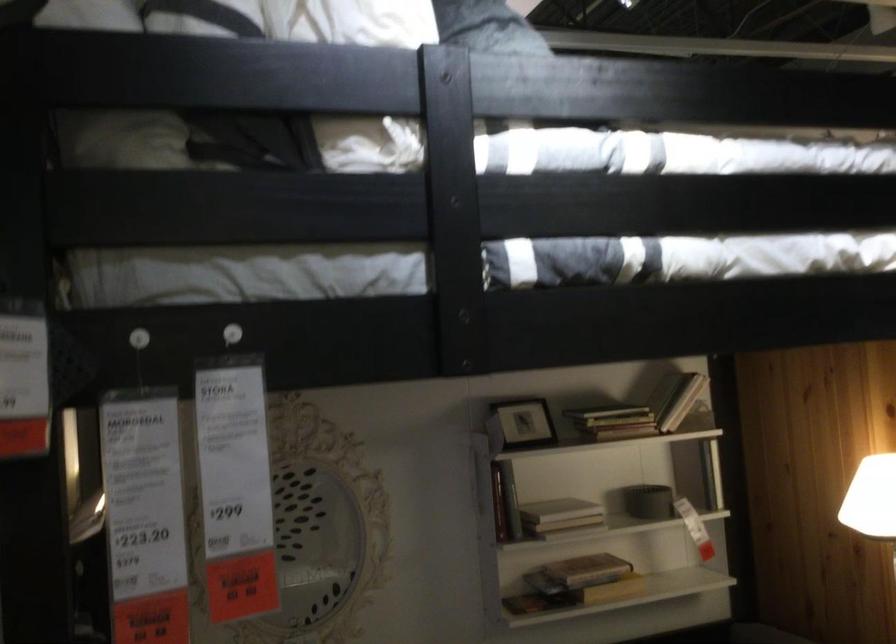
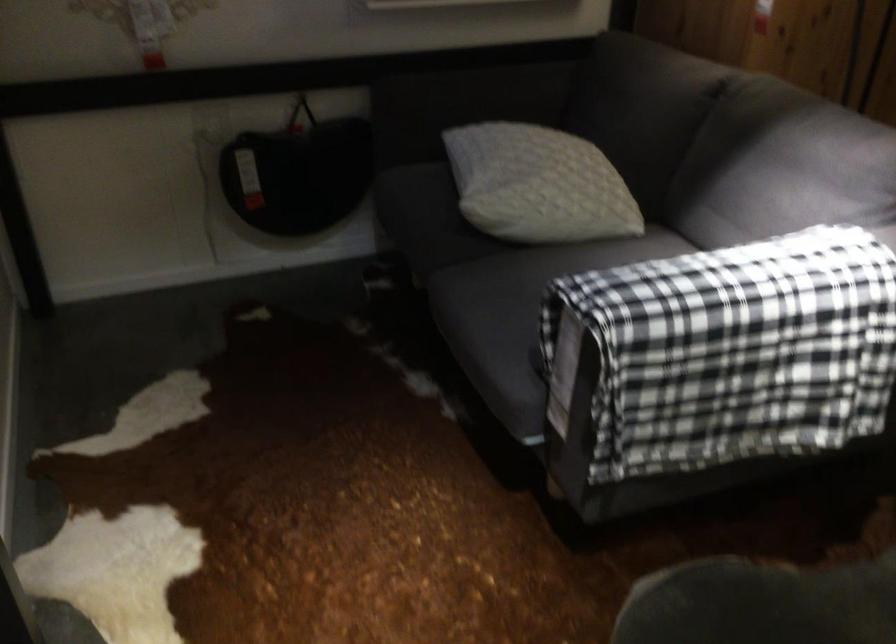
Question: Based on the continuous images, in which direction is the camera rotating? Reply with the corresponding letter.

Choices:
 (A) Left
 (B) Right
 (C) Up
 (D) Down

Answer: (D)